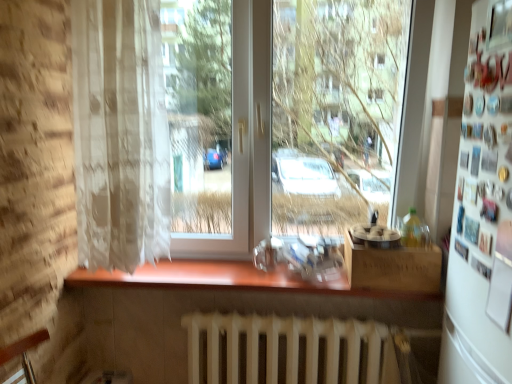
In order to face transparent glass window at center, should I rotate leftwards or rightwards?

To align with it, rotate right about 3.346°.

This screenshot has height=384, width=512. What do you see at coordinates (207, 277) in the screenshot?
I see `wooden counter at center` at bounding box center [207, 277].

Locate an element on the screen. The image size is (512, 384). wooden box at lower right is located at coordinates (393, 267).

Image resolution: width=512 pixels, height=384 pixels. Describe the element at coordinates (120, 134) in the screenshot. I see `white lace curtain at left` at that location.

You are a GUI agent. You are given a task and a screenshot of the screen. Output one action in this format:
    pyautogui.click(x=<x>, y=<y>)
    Task: Click on the white matte refrigerator at right
    This screenshot has height=384, width=512.
    Given the screenshot: What is the action you would take?
    pyautogui.click(x=482, y=211)

Is wooden counter at center smaller than transparent glass window at center?

Indeed, wooden counter at center has a smaller size compared to transparent glass window at center.

From the image's perspective, between wooden counter at center and transparent glass window at center, which one is located above?

transparent glass window at center, from the image's perspective.

Who is taller, wooden counter at center or transparent glass window at center?

transparent glass window at center.

Can you confirm if wooden counter at center is positioned to the left of transparent glass window at center?

Correct, you'll find wooden counter at center to the left of transparent glass window at center.

Does wooden box at lower right have a lesser width compared to white matte radiator at lower center?

Incorrect, the width of wooden box at lower right is not less than that of white matte radiator at lower center.

Is the depth of wooden box at lower right greater than that of white matte radiator at lower center?

Yes, it is behind white matte radiator at lower center.

Is wooden box at lower right oriented towards white matte radiator at lower center?

No.

Does white matte radiator at lower center appear on the right side of white matte refrigerator at right?

No, white matte radiator at lower center is not to the right of white matte refrigerator at right.

The image size is (512, 384). Identify the location of fridge lying above the white matte radiator at lower center (from the image's perspective). (482, 211).

From the image's perspective, which is above, white matte radiator at lower center or white matte refrigerator at right?

white matte refrigerator at right.

Which object is wider, white matte radiator at lower center or white matte refrigerator at right?

Wider between the two is white matte radiator at lower center.

How many degrees apart are the facing directions of wooden box at lower right and wooden counter at center?

They differ by 4.27e-05 degrees in their facing directions.

From a real-world perspective, is wooden box at lower right on wooden counter at center?

Indeed, from a real-world perspective, wooden box at lower right stands above wooden counter at center.

Between wooden box at lower right and wooden counter at center, which one has less height?

Standing shorter between the two is wooden counter at center.

From a real-world perspective, who is located lower, transparent glass window at center or wooden counter at center?

wooden counter at center, from a real-world perspective.

Who is bigger, transparent glass window at center or wooden counter at center?

Bigger between the two is transparent glass window at center.

Is transparent glass window at center far away from wooden counter at center?

That's not correct — transparent glass window at center is a little close to wooden counter at center.

What are the coordinates of `window box lying on the left of white matte refrigerator at right` in the screenshot? It's located at (393, 267).

From the image's perspective, is wooden box at lower right located above or below white matte refrigerator at right?

wooden box at lower right is below white matte refrigerator at right.

Which is in front, point (395, 274) or point (506, 130)?

Positioned in front is point (506, 130).

Is wooden box at lower right oriented away from white matte refrigerator at right?

No, wooden box at lower right's orientation is not away from white matte refrigerator at right.

Between white matte refrigerator at right and white lace curtain at left, which one has smaller width?

white matte refrigerator at right is thinner.

Is white matte refrigerator at right next to white lace curtain at left and touching it?

No, white matte refrigerator at right is not in contact with white lace curtain at left.

Considering the relative positions of white matte refrigerator at right and white lace curtain at left in the image provided, is white matte refrigerator at right to the right of white lace curtain at left from the viewer's perspective?

Correct, you'll find white matte refrigerator at right to the right of white lace curtain at left.

Find the location of `window in front of the wooden counter at center`. window in front of the wooden counter at center is located at coordinates (290, 119).

Locate an element on the screen. The width and height of the screenshot is (512, 384). window box above the white matte radiator at lower center (from a real-world perspective) is located at coordinates (393, 267).

When comparing their distances from white matte refrigerator at right, does white lace curtain at left or transparent glass window at center seem closer?

Among the two, transparent glass window at center is located nearer to white matte refrigerator at right.

Consider the image. Considering their positions, is white matte radiator at lower center positioned closer to wooden counter at center than wooden box at lower right?

white matte radiator at lower center lies closer to wooden counter at center than the other object.

Considering their positions, is wooden counter at center positioned closer to white matte radiator at lower center than white matte refrigerator at right?

wooden counter at center lies closer to white matte radiator at lower center than the other object.

Looking at the image, which one is located further to transparent glass window at center, white matte refrigerator at right or white matte radiator at lower center?

white matte refrigerator at right is positioned further to the anchor transparent glass window at center.

Which object lies nearer to the anchor point white lace curtain at left, white matte radiator at lower center or transparent glass window at center?

transparent glass window at center is closer to white lace curtain at left.

When comparing their distances from white lace curtain at left, does white matte refrigerator at right or transparent glass window at center seem further?

white matte refrigerator at right is positioned further to the anchor white lace curtain at left.

Which object lies nearer to the anchor point white lace curtain at left, white matte refrigerator at right or wooden counter at center?

Based on the image, wooden counter at center appears to be nearer to white lace curtain at left.

From the image, which object appears to be nearer to wooden box at lower right, white lace curtain at left or transparent glass window at center?

transparent glass window at center is closer to wooden box at lower right.

Identify the location of counter top located between white lace curtain at left and wooden box at lower right in the left-right direction. (207, 277).

Image resolution: width=512 pixels, height=384 pixels. In order to click on counter top situated between white lace curtain at left and white matte refrigerator at right from left to right in this screenshot , I will do `click(207, 277)`.

Locate an element on the screen. window box situated between white lace curtain at left and white matte refrigerator at right from left to right is located at coordinates (393, 267).

What are the coordinates of `window between white matte refrigerator at right and wooden counter at center from front to back` in the screenshot? It's located at (290, 119).